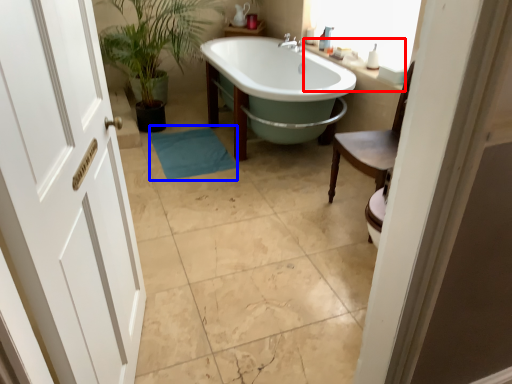
Question: Which object appears closest to the camera in this image, counter top (highlighted by a red box) or bath mat (highlighted by a blue box)?

Choices:
 (A) counter top
 (B) bath mat

Answer: (A)